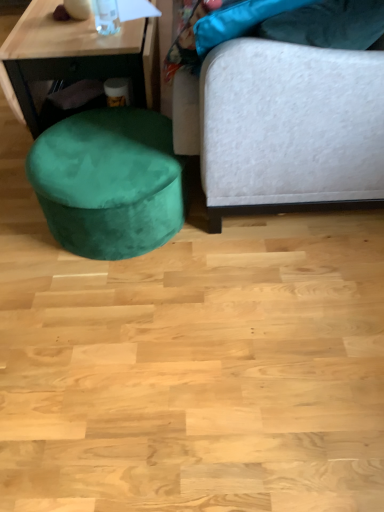
Image resolution: width=384 pixels, height=512 pixels. I want to click on vacant region in front of transparent glass bottle at upper left, so click(107, 41).